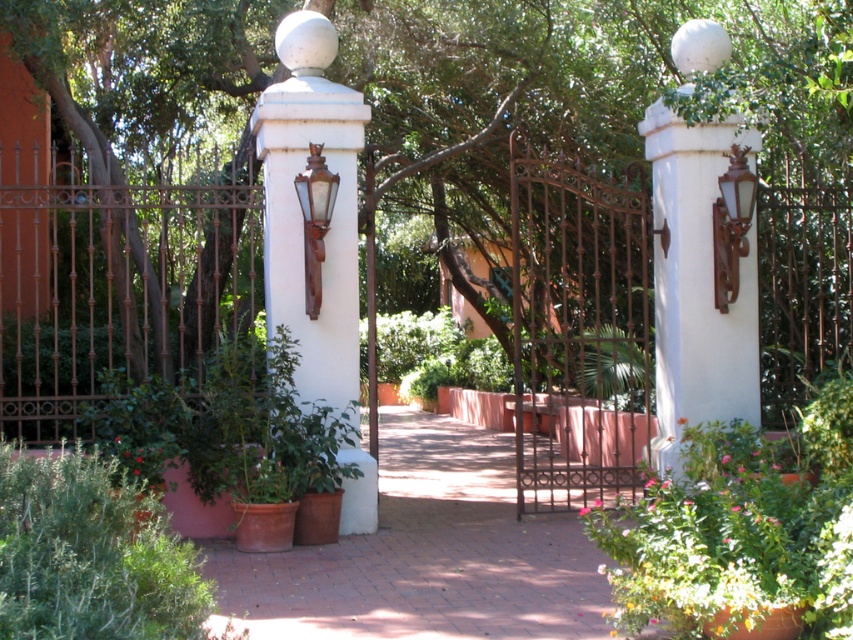
Locate an element on the screen. Image resolution: width=853 pixels, height=640 pixels. terracotta brick path at center is located at coordinates (427, 554).

The width and height of the screenshot is (853, 640). I want to click on terracotta brick path at center, so click(x=427, y=554).

Between terracotta brick path at center and green fuzzy bush at lower left, which one is positioned higher?

Positioned higher is green fuzzy bush at lower left.

Is terracotta brick path at center positioned behind green fuzzy bush at lower left?

Yes, terracotta brick path at center is further from the viewer.

Image resolution: width=853 pixels, height=640 pixels. I want to click on terracotta brick path at center, so click(x=427, y=554).

Who is higher up, green leafy plant at center or white painted stone wall at upper right?

white painted stone wall at upper right is above.

Is green leafy plant at center below white painted stone wall at upper right?

Correct, green leafy plant at center is located below white painted stone wall at upper right.

Image resolution: width=853 pixels, height=640 pixels. In order to click on green leafy plant at center in this screenshot , I will do `click(741, 529)`.

The height and width of the screenshot is (640, 853). Identify the location of green leafy plant at center. (741, 529).